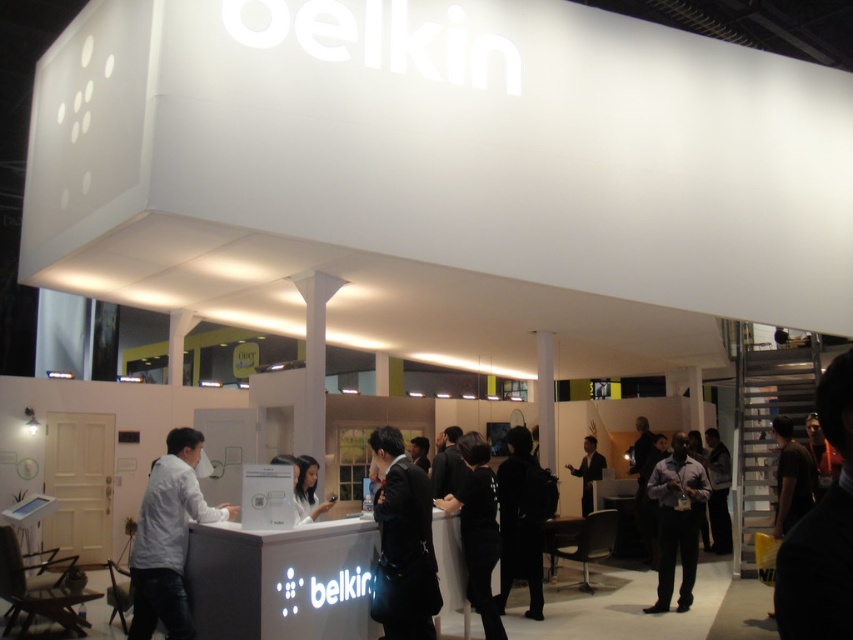
You are a visitor at the Belkin exhibition booth and notice two items at the center. Which item is positioned lower between the matte black shirt at center and the black matte coat at center?

The matte black shirt at center is located below the black matte coat at center, so it is positioned lower.

You are an event organizer who needs to place a 1.2 meter long table in the Belkin exhibition booth. The table must be placed near the black leather jacket at center. Is there enough space to place the table there?

The position of black leather jacket at center is at point (405, 540). However, without knowing the dimensions of the booth or the available space around the jacket, it is impossible to determine if the table will fit. Please provide more information about the booth layout or the space around the jacket.

You are standing in front of the Belkin booth and notice a black leather jacket at center and a white glossy phone at center. Which object is positioned closer to you?

The black leather jacket at center is closer to the viewer than the white glossy phone at center.